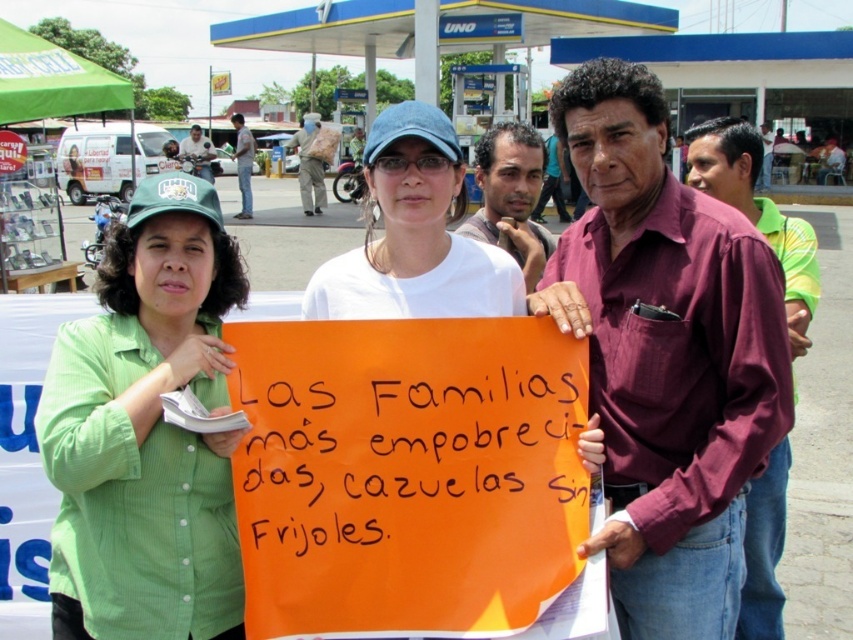
From the picture: Is smooth brown shirt at center to the left of dark brown leather jacket at center from the viewer's perspective?

In fact, smooth brown shirt at center is to the right of dark brown leather jacket at center.

Measure the distance from smooth brown shirt at center to dark brown leather jacket at center.

The distance of smooth brown shirt at center from dark brown leather jacket at center is 8.20 meters.

Between point (560, 212) and point (244, 195), which one is positioned in front?

Point (560, 212) is more forward.

The height and width of the screenshot is (640, 853). In order to click on smooth brown shirt at center in this screenshot , I will do `click(550, 180)`.

What do you see at coordinates (550, 180) in the screenshot? I see `smooth brown shirt at center` at bounding box center [550, 180].

Based on the photo, is smooth brown shirt at center to the right of matte black helmet at upper left from the viewer's perspective?

Indeed, smooth brown shirt at center is positioned on the right side of matte black helmet at upper left.

Is point (546, 160) positioned after point (202, 160)?

No, it is in front of (202, 160).

Identify the location of smooth brown shirt at center. The image size is (853, 640). (550, 180).

Who is shorter, maroon cotton shirt at center or smooth brown shirt at center?

Standing shorter between the two is maroon cotton shirt at center.

Can you confirm if maroon cotton shirt at center is taller than smooth brown shirt at center?

Incorrect, maroon cotton shirt at center's height is not larger of smooth brown shirt at center's.

Who is more distant from viewer, (735, 278) or (540, 221)?

The point (540, 221) is behind.

Find the location of a particular element. Image resolution: width=853 pixels, height=640 pixels. maroon cotton shirt at center is located at coordinates (666, 356).